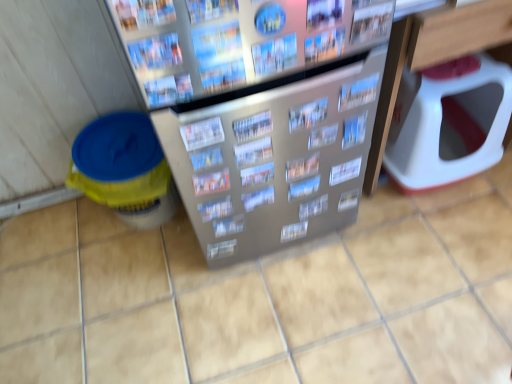
Where is `vacant space that is to the left of yellow plastic bucket at left`? This screenshot has width=512, height=384. vacant space that is to the left of yellow plastic bucket at left is located at coordinates (56, 241).